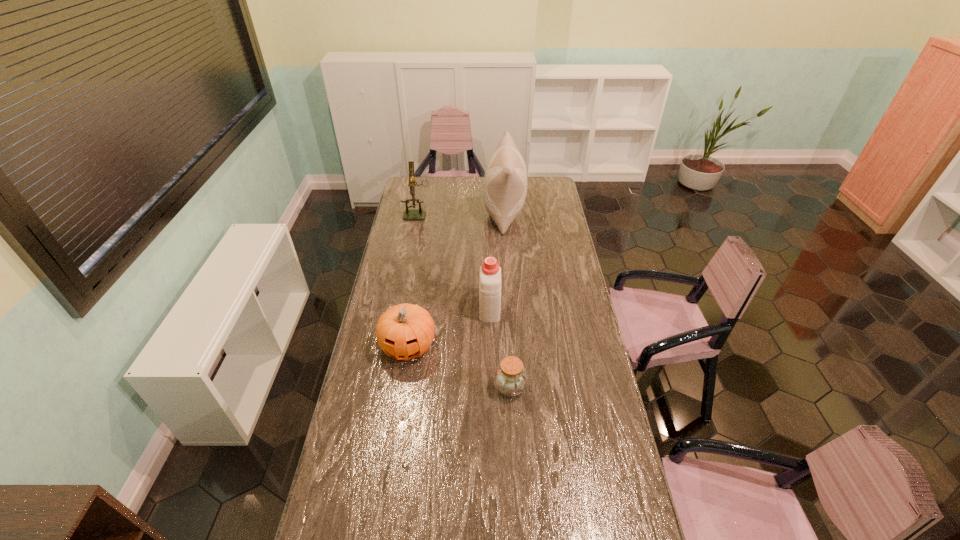
Locate an element on the screen. vacant region located at the eyepiece of the microscope is located at coordinates (415, 226).

Identify the location of vacant point located 0.240m on the handle side of the third nearest object. (489, 259).

This screenshot has width=960, height=540. Find the location of `free space located on the handle side of the third nearest object`. free space located on the handle side of the third nearest object is located at coordinates (489, 272).

Locate an element on the screen. The height and width of the screenshot is (540, 960). free space located on the handle side of the third nearest object is located at coordinates (489, 260).

The width and height of the screenshot is (960, 540). I want to click on vacant region located on the front-facing side of the second nearest object, so 396,426.

You are a GUI agent. You are given a task and a screenshot of the screen. Output one action in this format:
    pyautogui.click(x=<x>, y=<y>)
    Task: Click on the blank area located 0.270m on the front of the nearest object
    
    Given the screenshot: What is the action you would take?
    (516, 477)

The height and width of the screenshot is (540, 960). Identify the location of object that is at the far edge. (505, 182).

Locate an element on the screen. This screenshot has width=960, height=540. microscope present at the left edge is located at coordinates (419, 214).

Identify the location of pumpkin present at the left edge. (405, 331).

Find the location of `free spot at the far edge of the desktop`. free spot at the far edge of the desktop is located at coordinates (528, 185).